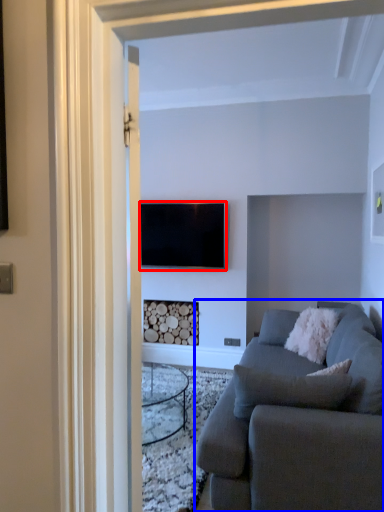
Question: Which of the following is the closest to the observer, television (highlighted by a red box) or studio couch (highlighted by a blue box)?

Choices:
 (A) television
 (B) studio couch

Answer: (B)